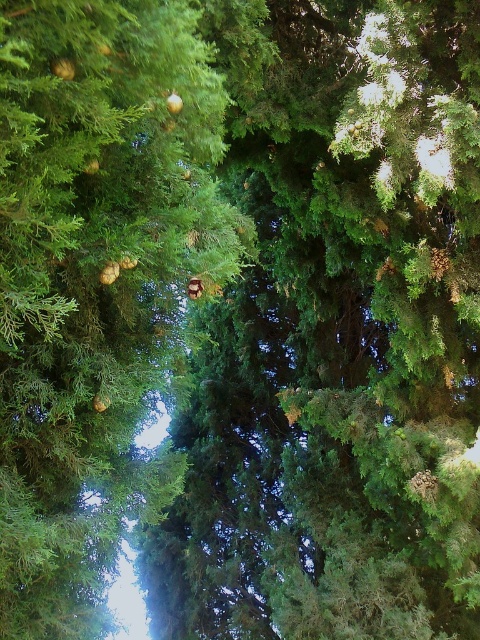
Question: Which point is closer to the camera taking this photo?

Choices:
 (A) (166, 490)
 (B) (226, 586)

Answer: (A)

Question: Can you confirm if green textured pine tree at center is wider than green matte pine cone at upper center?

Choices:
 (A) yes
 (B) no

Answer: (A)

Question: Which point is farther to the camera?

Choices:
 (A) (464, 460)
 (B) (108, 428)

Answer: (A)

Question: Does green textured pine tree at center lie in front of green matte pine cone at upper center?

Choices:
 (A) no
 (B) yes

Answer: (A)

Question: Which object is farther from the camera taking this photo?

Choices:
 (A) green textured pine tree at center
 (B) green matte pine cone at upper center

Answer: (A)

Question: Observing the image, what is the correct spatial positioning of green textured pine tree at center in reference to green matte pine cone at upper center?

Choices:
 (A) below
 (B) above

Answer: (A)